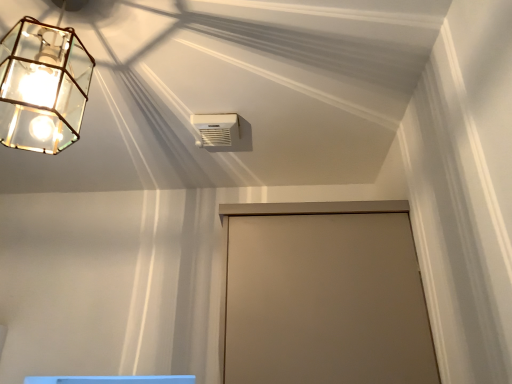
Identify the location of beige matte door at center. (324, 295).

The height and width of the screenshot is (384, 512). I want to click on beige matte door at center, so click(324, 295).

Considering the points (34, 144) and (326, 240), which point is in front, point (34, 144) or point (326, 240)?

The point (326, 240) is in front.

Is clear glass lantern at upper left positioned with its back to beige matte door at center?

No, beige matte door at center is not at the back of clear glass lantern at upper left.

Does clear glass lantern at upper left have a smaller size compared to beige matte door at center?

Indeed, clear glass lantern at upper left has a smaller size compared to beige matte door at center.

Looking at this image, is clear glass lantern at upper left far away from beige matte door at center?

No, clear glass lantern at upper left is not far away from beige matte door at center.

Is white plastic air conditioning unit at upper center bigger than beige matte door at center?

No.

Can you see white plastic air conditioning unit at upper center touching beige matte door at center?

white plastic air conditioning unit at upper center and beige matte door at center are clearly separated.

Is white plastic air conditioning unit at upper center turned away from beige matte door at center?

That's not correct — white plastic air conditioning unit at upper center is not looking away from beige matte door at center.

From a real-world perspective, is white plastic air conditioning unit at upper center on beige matte door at center?

Yes.

From a real-world perspective, who is located lower, white plastic air conditioning unit at upper center or clear glass lantern at upper left?

clear glass lantern at upper left is physically lower.

Which object is positioned more to the right, white plastic air conditioning unit at upper center or clear glass lantern at upper left?

white plastic air conditioning unit at upper center.

Is white plastic air conditioning unit at upper center aimed at clear glass lantern at upper left?

No, white plastic air conditioning unit at upper center is not aimed at clear glass lantern at upper left.

Between beige matte door at center and clear glass lantern at upper left, which one appears on the right side from the viewer's perspective?

beige matte door at center is more to the right.

Can you tell me how much beige matte door at center and clear glass lantern at upper left differ in facing direction?

7.75 degrees separate the facing orientations of beige matte door at center and clear glass lantern at upper left.

Is the depth of beige matte door at center greater than that of clear glass lantern at upper left?

Yes, it is behind clear glass lantern at upper left.

Identify the location of lamp on the left of beige matte door at center. (42, 86).

Can we say clear glass lantern at upper left lies outside white plastic air conditioning unit at upper center?

Yes, clear glass lantern at upper left is outside of white plastic air conditioning unit at upper center.

Is clear glass lantern at upper left wider than white plastic air conditioning unit at upper center?

Correct, the width of clear glass lantern at upper left exceeds that of white plastic air conditioning unit at upper center.

There is a clear glass lantern at upper left. Identify the location of air conditioning above it (from a real-world perspective). (216, 129).

Is point (297, 359) farther from viewer compared to point (222, 117)?

No, it is in front of (222, 117).

From a real-world perspective, does beige matte door at center stand above white plastic air conditioning unit at upper center?

No, from a real-world perspective, beige matte door at center is not above white plastic air conditioning unit at upper center.

Is beige matte door at center bigger or smaller than white plastic air conditioning unit at upper center?

Considering their sizes, beige matte door at center takes up more space than white plastic air conditioning unit at upper center.

Is beige matte door at center next to white plastic air conditioning unit at upper center?

No, beige matte door at center is not in contact with white plastic air conditioning unit at upper center.

Identify the location of lamp on the left of beige matte door at center. The height and width of the screenshot is (384, 512). (42, 86).

I want to click on door located in front of the white plastic air conditioning unit at upper center, so point(324,295).

Which object lies nearer to the anchor point white plastic air conditioning unit at upper center, beige matte door at center or clear glass lantern at upper left?

clear glass lantern at upper left is positioned closer to the anchor white plastic air conditioning unit at upper center.

Which object lies further to the anchor point white plastic air conditioning unit at upper center, clear glass lantern at upper left or beige matte door at center?

The object further to white plastic air conditioning unit at upper center is beige matte door at center.

Looking at the image, which one is located closer to clear glass lantern at upper left, beige matte door at center or white plastic air conditioning unit at upper center?

white plastic air conditioning unit at upper center lies closer to clear glass lantern at upper left than the other object.

Looking at this image, estimate the real-world distances between objects in this image. Which object is further from beige matte door at center, white plastic air conditioning unit at upper center or clear glass lantern at upper left?

clear glass lantern at upper left.

Looking at the image, which one is located further to beige matte door at center, clear glass lantern at upper left or white plastic air conditioning unit at upper center?

clear glass lantern at upper left is further to beige matte door at center.

Looking at the image, which one is located closer to clear glass lantern at upper left, white plastic air conditioning unit at upper center or beige matte door at center?

Based on the image, white plastic air conditioning unit at upper center appears to be nearer to clear glass lantern at upper left.

I want to click on air conditioning between clear glass lantern at upper left and beige matte door at center in the vertical direction, so click(x=216, y=129).